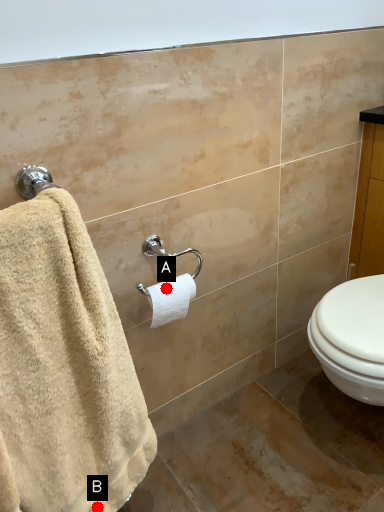
Question: Two points are circled on the image, labeled by A and B beside each circle. Which point appears farthest from the camera in this image?

Choices:
 (A) A is further
 (B) B is further

Answer: (A)